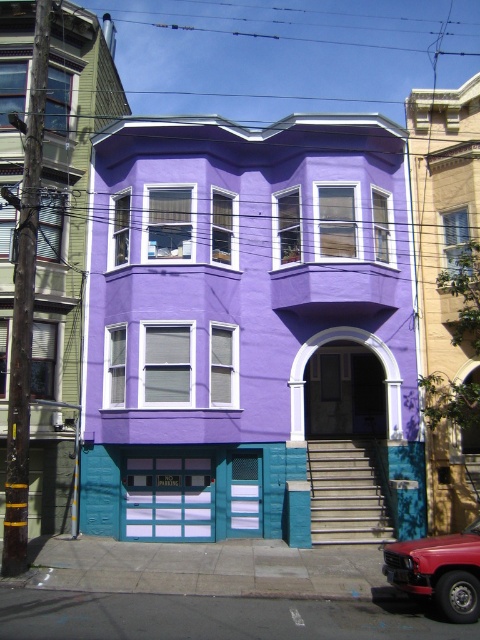
Question: Which point is closer to the camera?

Choices:
 (A) matte blue garage door at lower center
 (B) shiny red car at lower right

Answer: (B)

Question: Which object is farther from the camera taking this photo?

Choices:
 (A) shiny red car at lower right
 (B) matte blue garage door at lower center

Answer: (B)

Question: Does matte blue garage door at lower center have a lesser width compared to shiny red car at lower right?

Choices:
 (A) no
 (B) yes

Answer: (A)

Question: Which object appears farthest from the camera in this image?

Choices:
 (A) matte blue garage door at lower center
 (B) shiny red car at lower right

Answer: (A)

Question: Is matte blue garage door at lower center below shiny red car at lower right?

Choices:
 (A) yes
 (B) no

Answer: (A)

Question: Is matte blue garage door at lower center smaller than shiny red car at lower right?

Choices:
 (A) yes
 (B) no

Answer: (A)